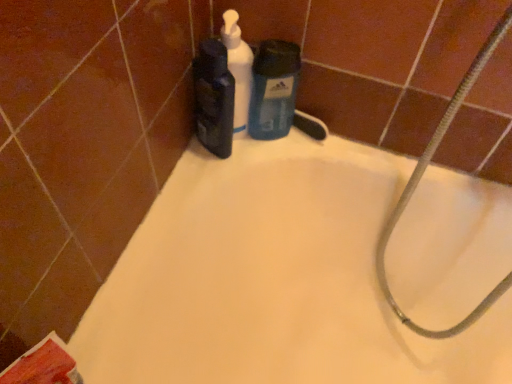
Question: Relative to matte black bottle at upper center, acting as the first cleaning product starting from the left, is white matte bathtub at upper center in front or behind?

Choices:
 (A) front
 (B) behind

Answer: (A)

Question: Considering the relative positions of white matte bathtub at upper center and matte black bottle at upper center, the third cleaning product in the right-to-left sequence, in the image provided, is white matte bathtub at upper center to the left or to the right of matte black bottle at upper center, the third cleaning product in the right-to-left sequence,?

Choices:
 (A) left
 (B) right

Answer: (B)

Question: Based on their relative distances, which object is farther from the white matte bathtub at upper center?

Choices:
 (A) blue matte liquid soap at center, which is the 3th cleaning product in left-to-right order
 (B) silvery metallic hose at upper right
 (C) white matte pump bottle at upper center, acting as the 2th cleaning product starting from the right
 (D) matte black bottle at upper center, acting as the first cleaning product starting from the left

Answer: (C)

Question: Estimate the real-world distances between objects in this image. Which object is farther from the blue matte liquid soap at center, which is the 3th cleaning product in left-to-right order?

Choices:
 (A) white matte pump bottle at upper center, which is counted as the second cleaning product, starting from the left
 (B) white matte bathtub at upper center
 (C) silvery metallic hose at upper right
 (D) matte black bottle at upper center, the third cleaning product in the right-to-left sequence

Answer: (B)